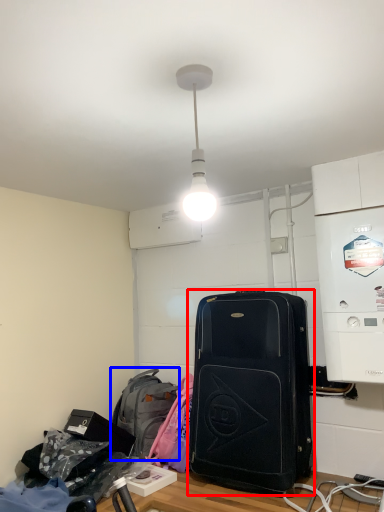
Question: Among these objects, which one is farthest to the camera, luggage and bags (highlighted by a red box) or backpack (highlighted by a blue box)?

Choices:
 (A) luggage and bags
 (B) backpack

Answer: (B)